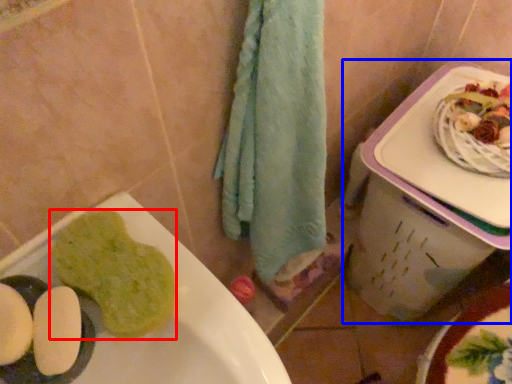
Question: Which object appears closest to the camera in this image, food (highlighted by a red box) or lunch box (highlighted by a blue box)?

Choices:
 (A) food
 (B) lunch box

Answer: (A)